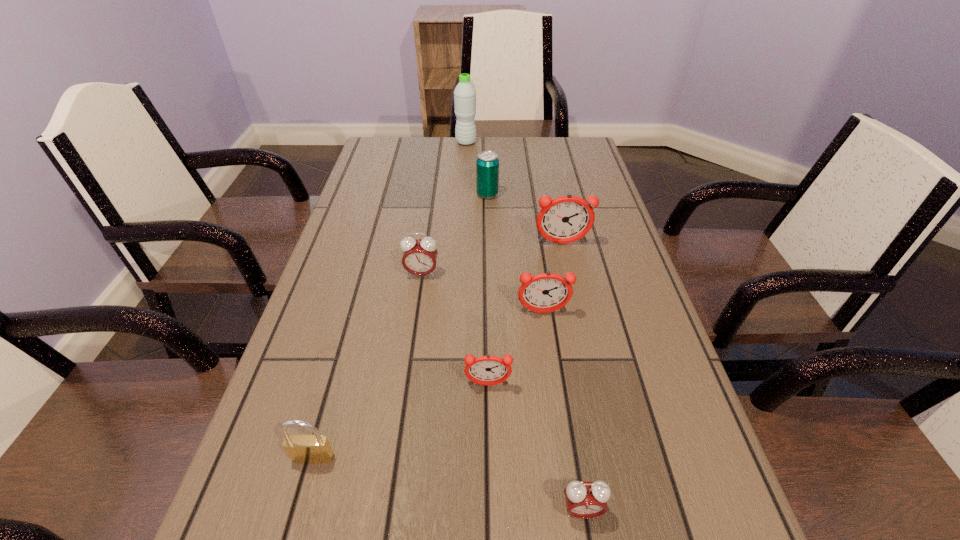
This screenshot has height=540, width=960. What are the coordinates of `padlock` in the screenshot? It's located at (308, 449).

The image size is (960, 540). I want to click on the leftmost object, so click(308, 449).

I want to click on the nearest object, so click(x=584, y=500).

This screenshot has height=540, width=960. What are the coordinates of `the right pink alarm clock` in the screenshot? It's located at (584, 500).

The height and width of the screenshot is (540, 960). What are the coordinates of `the smallest reddish-pink alarm clock` in the screenshot? It's located at (487, 370).

Locate an element on the screen. The image size is (960, 540). the third nearest object is located at coordinates (487, 370).

You are a GUI agent. You are given a task and a screenshot of the screen. Output one action in this format:
    pyautogui.click(x=<x>, y=<y>)
    Task: Click on the vacant area situated on the left of the farthest object
    
    Given the screenshot: What is the action you would take?
    442,143

Locate an element on the screen. The height and width of the screenshot is (540, 960). free space located on the front-facing side of the third farthest object is located at coordinates (579, 322).

What are the coordinates of `blank space located 0.180m on the left of the teal beer can` in the screenshot? It's located at (416, 194).

Find the location of a particular element. vacant space located on the clock face of the farther pink alarm clock is located at coordinates (405, 390).